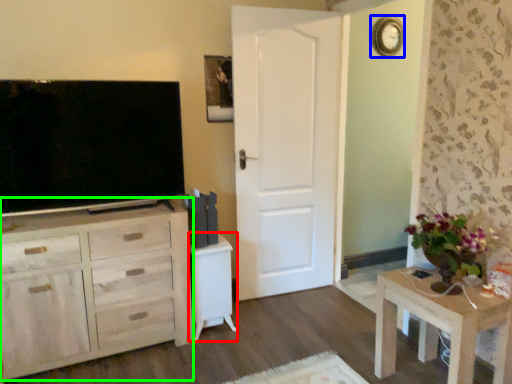
Question: Considering the real-world distances, which object is farthest from vanity (highlighted by a red box)? clock (highlighted by a blue box) or cabinetry (highlighted by a green box)?

Choices:
 (A) clock
 (B) cabinetry

Answer: (A)